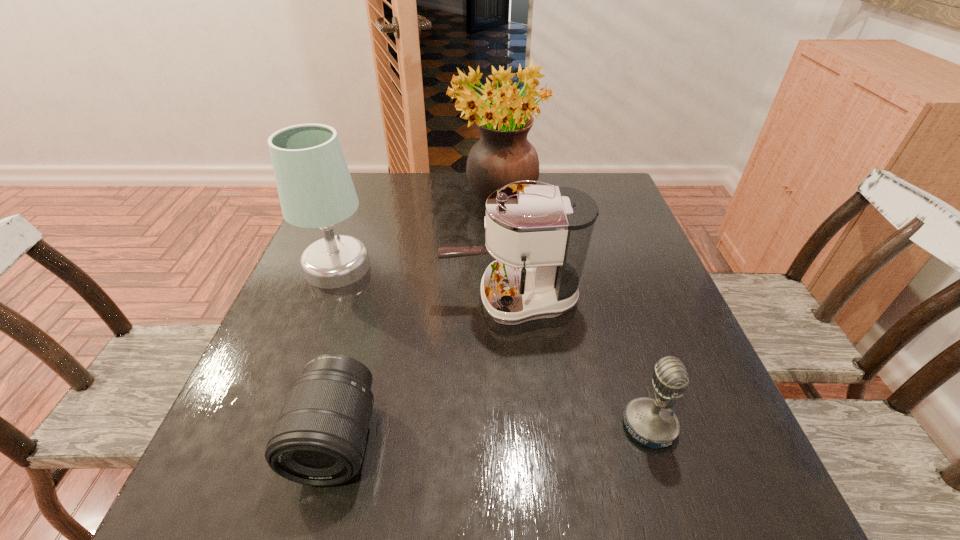
In the image, there is a desktop. Where is `vacant space at the far edge`? vacant space at the far edge is located at coordinates (462, 182).

In the image, there is a desktop. At what (x,y) coordinates should I click in order to perform the action: click on vacant region at the near edge. Please return your answer as a coordinate pair (x, y). Looking at the image, I should click on (570, 487).

You are a GUI agent. You are given a task and a screenshot of the screen. Output one action in this format:
    pyautogui.click(x=<x>, y=<y>)
    Task: Click on the vacant space at the left edge of the desktop
    The width and height of the screenshot is (960, 540).
    Given the screenshot: What is the action you would take?
    pyautogui.click(x=350, y=298)

Locate an element on the screen. free space at the right edge of the desktop is located at coordinates (682, 353).

This screenshot has height=540, width=960. What are the coordinates of `vacant position at the far right corner of the desktop` in the screenshot? It's located at (597, 175).

At what (x,y) coordinates should I click in order to perform the action: click on empty space between the third tallest object and the shortest object. Please return your answer as a coordinate pair (x, y). Looking at the image, I should click on (423, 369).

At what (x,y) coordinates should I click in order to perform the action: click on vacant point located between the flower arrangement and the shortest object. Please return your answer as a coordinate pair (x, y). The image size is (960, 540). Looking at the image, I should click on [x=417, y=321].

The height and width of the screenshot is (540, 960). In order to click on vacant area that lies between the lampshade and the farthest object in this screenshot , I will do `click(418, 235)`.

Identify the location of free space between the lampshade and the coffee maker. The height and width of the screenshot is (540, 960). point(424,283).

At what (x,y) coordinates should I click in order to perform the action: click on vacant area that lies between the farthest object and the second shortest object. Please return your answer as a coordinate pair (x, y). Looking at the image, I should click on (573, 315).